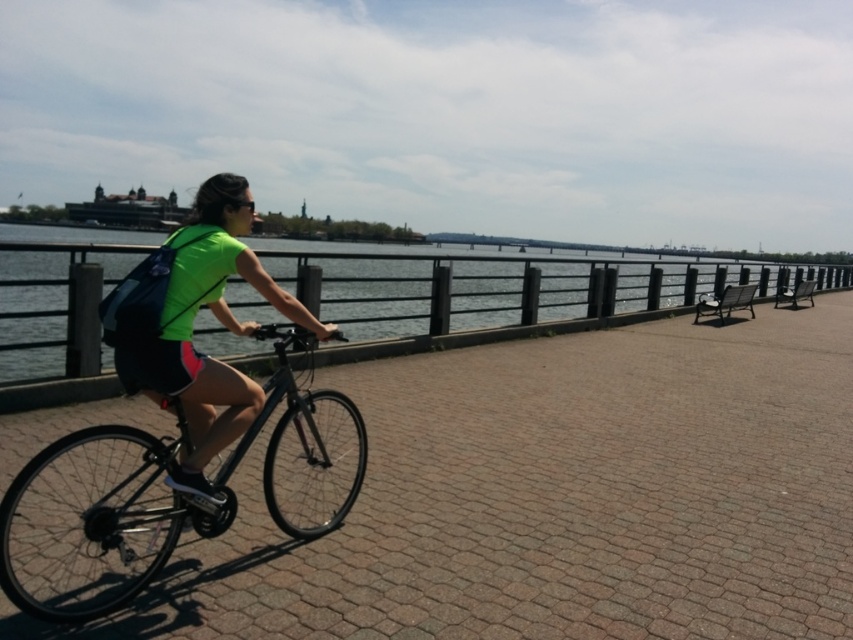
What are the coordinates of the clear blue water at center?

The clear blue water at center is located at point (502,285).

You are standing at the point closer to the viewer. Which point are you at, point (606, 339) or point (111, 548)?

You are at point (606, 339) because it is further to the viewer than point (111, 548).

You are a photographer planning to take a photo of the clear blue water at center and the neon green fabric at center. Which object should you focus on first if you want to capture both in a single frame without moving the camera?

You should focus on the clear blue water at center first because its width is larger than the neon green fabric at center, allowing more space to include both in the frame.